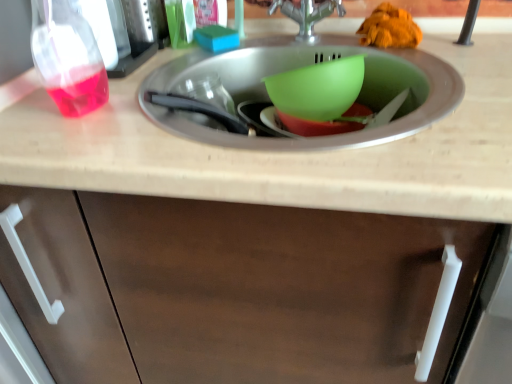
Question: Is silver metallic tap at center in front of or behind blue sponge at upper center, which appears as the second food when viewed from the right, in the image?

Choices:
 (A) front
 (B) behind

Answer: (A)

Question: Is point (337, 8) closer or farther from the camera than point (223, 48)?

Choices:
 (A) farther
 (B) closer

Answer: (A)

Question: Based on their relative distances, which object is nearer to the green plastic bowl at center, which is the 1th basin in top-to-bottom order?

Choices:
 (A) transparent plastic bottle at left
 (B) transparent plastic spray bottle at left
 (C) beige laminate countertop at center
 (D) blue sponge at upper center, the 1th food positioned from the left
 (E) silver metallic tap at center

Answer: (E)

Question: Which of these objects is positioned closest to the green plastic bowl at center, placed as the second basin when sorted from bottom to top?

Choices:
 (A) transparent plastic bottle at left
 (B) green plastic bowl at center, which ranks as the second basin in top-to-bottom order
 (C) beige laminate countertop at center
 (D) orange fuzzy sponge at upper right, the first food viewed from the right
 (E) silver metallic tap at center

Answer: (B)